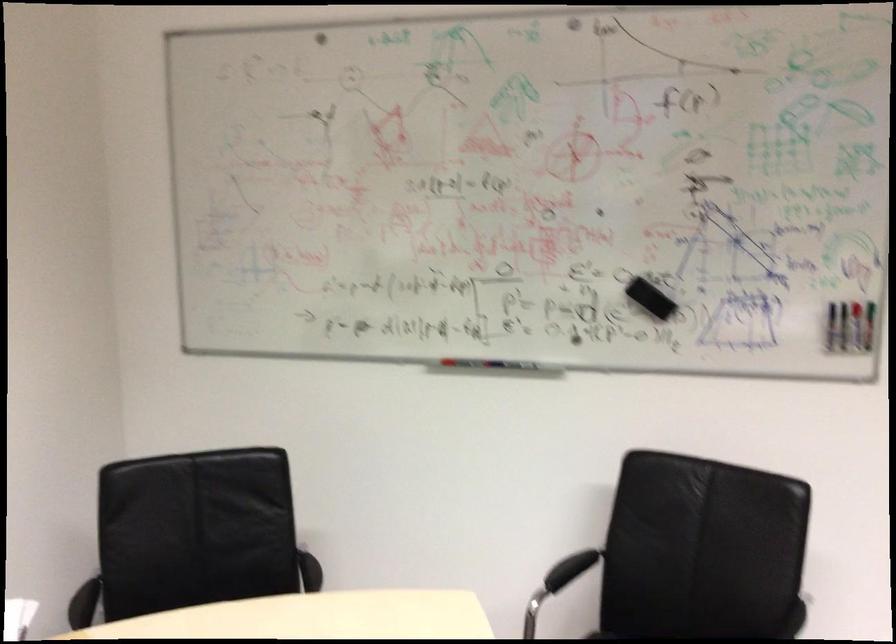
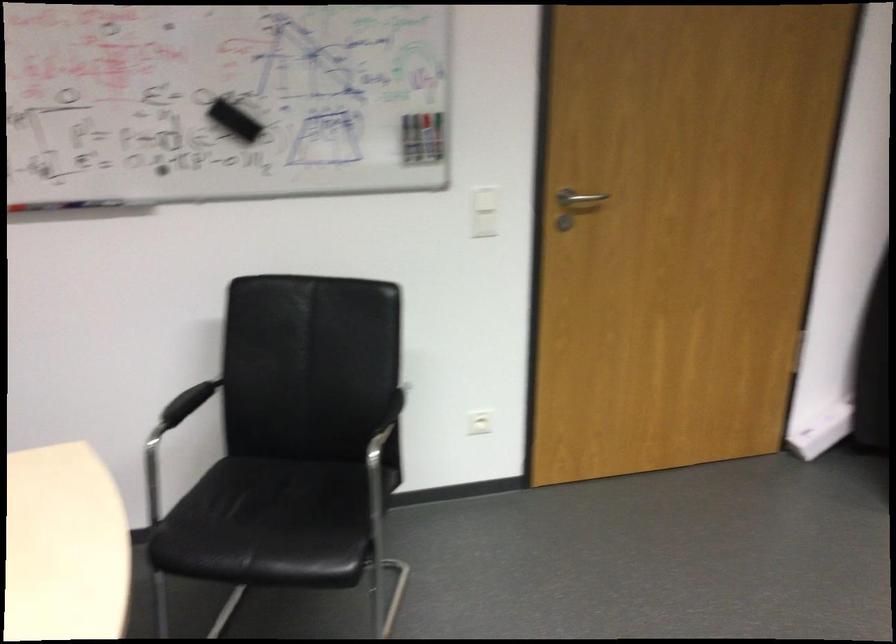
In the second image, find the point that corresponds to point (652, 295) in the first image.

(233, 118)